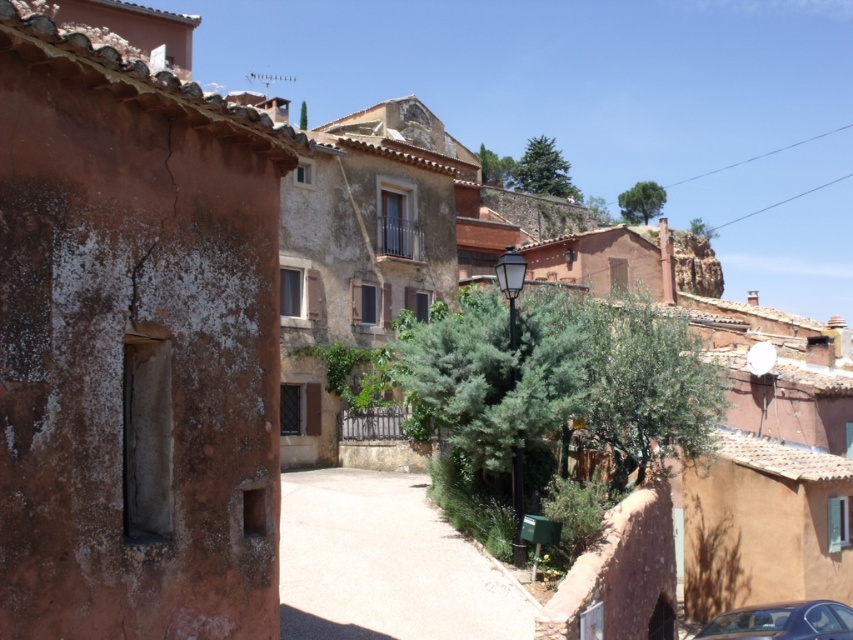
Question: Can you confirm if smooth concrete path at center is bigger than metallic silver car at lower right?

Choices:
 (A) yes
 (B) no

Answer: (A)

Question: Can you confirm if smooth concrete path at center is smaller than metallic silver car at lower right?

Choices:
 (A) yes
 (B) no

Answer: (B)

Question: Which point appears closest to the camera in this image?

Choices:
 (A) (828, 609)
 (B) (316, 620)

Answer: (B)

Question: Can you confirm if smooth concrete path at center is bigger than metallic silver car at lower right?

Choices:
 (A) yes
 (B) no

Answer: (A)

Question: Among these objects, which one is farthest from the camera?

Choices:
 (A) smooth concrete path at center
 (B) metallic silver car at lower right

Answer: (B)